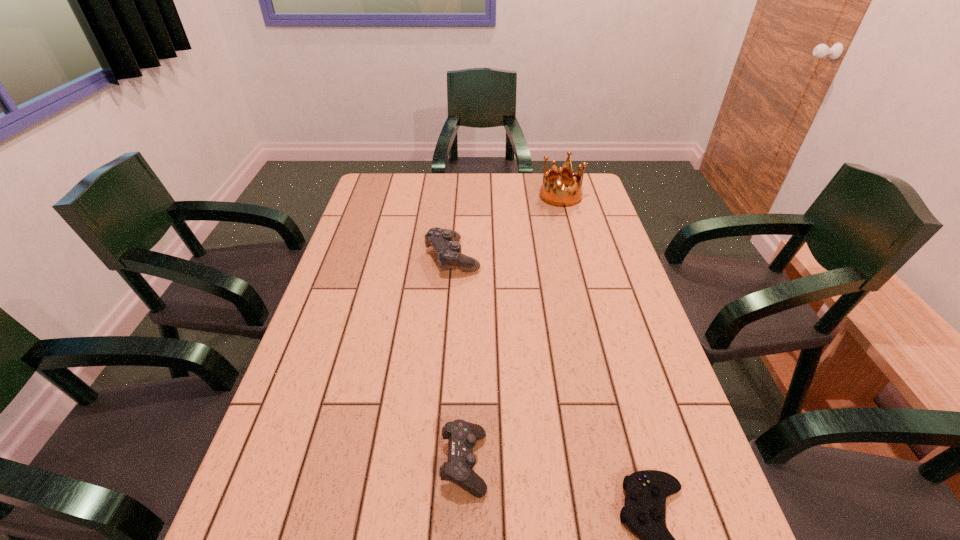
Identify the location of object at the far right corner. (552, 191).

Where is `vacant position at the far edge of the desktop`? Image resolution: width=960 pixels, height=540 pixels. vacant position at the far edge of the desktop is located at coordinates (410, 194).

At what (x,y) coordinates should I click in order to perform the action: click on free location at the left edge. Please return your answer as a coordinate pair (x, y). Image resolution: width=960 pixels, height=540 pixels. Looking at the image, I should click on (336, 276).

Identify the location of vacant region at the right edge. (663, 374).

Where is `vacant space at the far left corner of the desktop`? This screenshot has width=960, height=540. vacant space at the far left corner of the desktop is located at coordinates (379, 173).

Locate an element on the screen. The image size is (960, 540). free space between the farthest object and the third nearest object is located at coordinates (507, 227).

Find the location of a particular element. free space between the second tallest control and the tallest object is located at coordinates (513, 329).

What are the coordinates of `unoccupied area between the farthest control and the tallest object` in the screenshot? It's located at (507, 227).

Image resolution: width=960 pixels, height=540 pixels. I want to click on vacant space that's between the tallest control and the farthest object, so click(507, 227).

At what (x,y) coordinates should I click in order to perform the action: click on free space between the farthest control and the crown. Please return your answer as a coordinate pair (x, y). The height and width of the screenshot is (540, 960). Looking at the image, I should click on (507, 227).